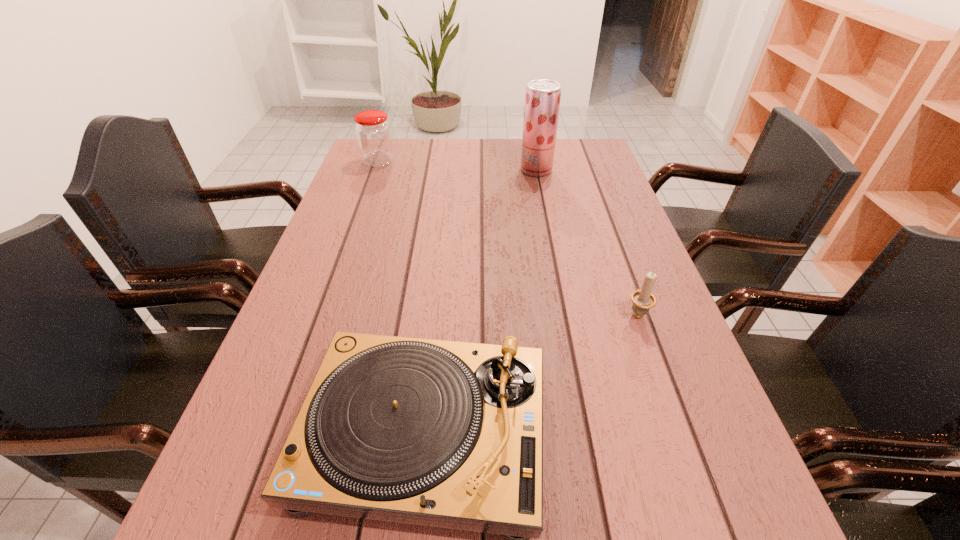
Where is `unoccupied area between the second tallest object and the rightmost object`? unoccupied area between the second tallest object and the rightmost object is located at coordinates (508, 237).

Where is `empty space between the candle_holder and the second tallest object`? The width and height of the screenshot is (960, 540). empty space between the candle_holder and the second tallest object is located at coordinates (508, 237).

Find the location of a particular element. the third closest object relative to the record player is located at coordinates (373, 133).

You are a GUI agent. You are given a task and a screenshot of the screen. Output one action in this format:
    pyautogui.click(x=<x>, y=<y>)
    Task: Click on the object that can be found as the closest to the third object from left to right
    The image size is (960, 540).
    Given the screenshot: What is the action you would take?
    pyautogui.click(x=373, y=133)

Where is `free location that satisfies the following two spatial constraints: 1. on the front side of the third object from left to right; 2. on the right side of the jar`? The height and width of the screenshot is (540, 960). free location that satisfies the following two spatial constraints: 1. on the front side of the third object from left to right; 2. on the right side of the jar is located at coordinates (375, 170).